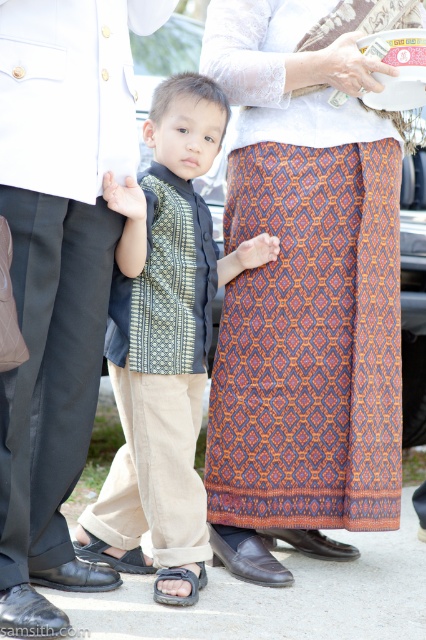
Question: Is matte black suit at center above matte green batik hand at center?

Choices:
 (A) yes
 (B) no

Answer: (B)

Question: Does matte green shirt at center appear under white lace handbag at upper center?

Choices:
 (A) no
 (B) yes

Answer: (B)

Question: Is patterned fabric skirt at center in front of matte green shirt at center?

Choices:
 (A) yes
 (B) no

Answer: (B)

Question: Which object appears farthest from the camera in this image?

Choices:
 (A) matte orange batik hand at center
 (B) patterned fabric skirt at center

Answer: (A)

Question: Estimate the real-world distances between objects in this image. Which object is farther from the matte green batik hand at center?

Choices:
 (A) matte orange batik hand at center
 (B) matte black suit at center

Answer: (A)

Question: Estimate the real-world distances between objects in this image. Which object is farther from the white lace handbag at upper center?

Choices:
 (A) matte green shirt at center
 (B) matte orange batik hand at center

Answer: (A)